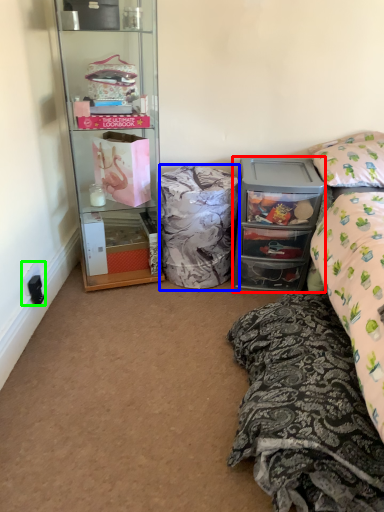
Question: Considering the real-world distances, which object is farthest from cabinetry (highlighted by a red box)? material (highlighted by a blue box) or power outlet (highlighted by a green box)?

Choices:
 (A) material
 (B) power outlet

Answer: (B)